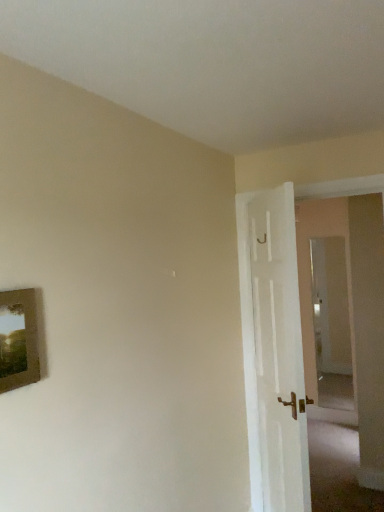
Locate an element on the screen. white wooden door at right is located at coordinates (273, 351).

Describe the element at coordinates (331, 323) in the screenshot. This screenshot has height=512, width=384. I see `transparent glass door at right` at that location.

The width and height of the screenshot is (384, 512). Find the location of `white wooden door at right`. white wooden door at right is located at coordinates (273, 351).

Is point (17, 376) closer to camera compared to point (279, 270)?

That is True.

How different are the orientations of wooden picture frame at left and white wooden door at right in degrees?

34.4 degrees separate the facing orientations of wooden picture frame at left and white wooden door at right.

Is wooden picture frame at left closer to the viewer compared to white wooden door at right?

That is True.

Which is closer to the camera, (294, 447) or (27, 361)?

Point (294, 447) appears to be farther away from the viewer than point (27, 361).

Considering the sizes of white wooden door at right and wooden picture frame at left in the image, is white wooden door at right wider or thinner than wooden picture frame at left?

Considering their sizes, white wooden door at right looks broader than wooden picture frame at left.

From the image's perspective, which one is positioned lower, white wooden door at right or wooden picture frame at left?

white wooden door at right, from the image's perspective.

From a real-world perspective, is white wooden door at right physically below wooden picture frame at left?

Indeed, from a real-world perspective, white wooden door at right is positioned beneath wooden picture frame at left.

Locate an element on the screen. The width and height of the screenshot is (384, 512). door located on the left of transparent glass door at right is located at coordinates (273, 351).

From a real-world perspective, who is located lower, transparent glass door at right or white wooden door at right?

transparent glass door at right, from a real-world perspective.

From the image's perspective, is transparent glass door at right located above or below white wooden door at right?

From the image's perspective, transparent glass door at right appears below white wooden door at right.

Consider the image. Which object is closer to the camera, transparent glass door at right or white wooden door at right?

white wooden door at right is closer to the camera.

Is wooden picture frame at left positioned beyond the bounds of transparent glass door at right?

wooden picture frame at left is positioned outside transparent glass door at right.

Does point (27, 326) come in front of point (324, 309)?

Yes, point (27, 326) is in front of point (324, 309).

Is wooden picture frame at left in front of or behind transparent glass door at right in the image?

wooden picture frame at left is positioned closer to the viewer than transparent glass door at right.

What's the angular difference between transparent glass door at right and wooden picture frame at left's facing directions?

The angular difference between transparent glass door at right and wooden picture frame at left is 90 degrees.

You are a GUI agent. You are given a task and a screenshot of the screen. Output one action in this format:
    pyautogui.click(x=<x>, y=<y>)
    Task: Click on the picture frame that appears in front of the transparent glass door at right
    
    Given the screenshot: What is the action you would take?
    pyautogui.click(x=18, y=340)

Is transparent glass door at right in front of wooden picture frame at left?

That is False.

Is transparent glass door at right turned away from wooden picture frame at left?

transparent glass door at right does not have its back to wooden picture frame at left.

Between white wooden door at right and transparent glass door at right, which one has less height?

Standing shorter between the two is transparent glass door at right.

Is white wooden door at right to the left of transparent glass door at right from the viewer's perspective?

Indeed, white wooden door at right is positioned on the left side of transparent glass door at right.

From the image's perspective, between white wooden door at right and transparent glass door at right, which one is located above?

white wooden door at right is shown above in the image.

Considering the relative sizes of white wooden door at right and transparent glass door at right in the image provided, is white wooden door at right bigger than transparent glass door at right?

Yes.

Image resolution: width=384 pixels, height=512 pixels. Find the location of `picture frame in front of the white wooden door at right`. picture frame in front of the white wooden door at right is located at coordinates (18, 340).

The image size is (384, 512). I want to click on door on the right side of wooden picture frame at left, so click(273, 351).

Looking at the image, which one is located further to wooden picture frame at left, transparent glass door at right or white wooden door at right?

transparent glass door at right is positioned further to the anchor wooden picture frame at left.

Looking at the image, which one is located further to white wooden door at right, wooden picture frame at left or transparent glass door at right?

The object further to white wooden door at right is transparent glass door at right.

Looking at this image, when comparing their distances from wooden picture frame at left, does white wooden door at right or transparent glass door at right seem further?

Based on the image, transparent glass door at right appears to be further to wooden picture frame at left.

Looking at the image, which one is located closer to transparent glass door at right, wooden picture frame at left or white wooden door at right?

Among the two, white wooden door at right is located nearer to transparent glass door at right.

Based on the photo, from the image, which object appears to be farther from white wooden door at right, transparent glass door at right or wooden picture frame at left?

The object further to white wooden door at right is transparent glass door at right.

Based on the photo, based on their spatial positions, is white wooden door at right or wooden picture frame at left further from transparent glass door at right?

Based on the image, wooden picture frame at left appears to be further to transparent glass door at right.

At what (x,y) coordinates should I click in order to perform the action: click on door between wooden picture frame at left and transparent glass door at right from front to back. Please return your answer as a coordinate pair (x, y). The image size is (384, 512). Looking at the image, I should click on (273, 351).